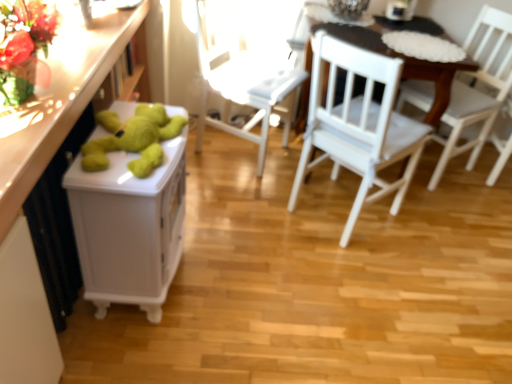
Where is `blank area beneath green plush bear at left (from a real-world perspective)`? Image resolution: width=512 pixels, height=384 pixels. blank area beneath green plush bear at left (from a real-world perspective) is located at coordinates (128, 149).